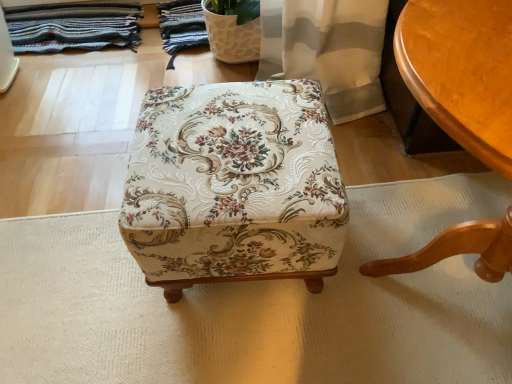
Question: Is smooth wooden table at right bigger than floral fabric ottoman at center?

Choices:
 (A) yes
 (B) no

Answer: (A)

Question: From a real-world perspective, is smooth wooden table at right on top of floral fabric ottoman at center?

Choices:
 (A) no
 (B) yes

Answer: (B)

Question: Is smooth wooden table at right thinner than floral fabric ottoman at center?

Choices:
 (A) no
 (B) yes

Answer: (A)

Question: Is smooth wooden table at right wider than floral fabric ottoman at center?

Choices:
 (A) no
 (B) yes

Answer: (B)

Question: Is smooth wooden table at right turned away from floral fabric ottoman at center?

Choices:
 (A) yes
 (B) no

Answer: (B)

Question: In terms of height, does floral fabric ottoman at center look taller or shorter compared to striped woolen blanket at upper left?

Choices:
 (A) tall
 (B) short

Answer: (A)

Question: Considering the positions of floral fabric ottoman at center and striped woolen blanket at upper left in the image, is floral fabric ottoman at center wider or thinner than striped woolen blanket at upper left?

Choices:
 (A) wide
 (B) thin

Answer: (A)

Question: From the image's perspective, is floral fabric ottoman at center positioned above or below striped woolen blanket at upper left?

Choices:
 (A) above
 (B) below

Answer: (B)

Question: Does point (249, 134) appear closer or farther from the camera than point (108, 21)?

Choices:
 (A) closer
 (B) farther

Answer: (A)

Question: Considering the positions of smooth wooden table at right and floral fabric ottoman at center in the image, is smooth wooden table at right wider or thinner than floral fabric ottoman at center?

Choices:
 (A) wide
 (B) thin

Answer: (A)

Question: Considering the positions of smooth wooden table at right and floral fabric ottoman at center in the image, is smooth wooden table at right taller or shorter than floral fabric ottoman at center?

Choices:
 (A) tall
 (B) short

Answer: (A)

Question: Is smooth wooden table at right to the left or to the right of floral fabric ottoman at center in the image?

Choices:
 (A) left
 (B) right

Answer: (B)

Question: In the image, is smooth wooden table at right positioned in front of or behind floral fabric ottoman at center?

Choices:
 (A) behind
 (B) front

Answer: (B)

Question: Considering the positions of smooth wooden table at right and striped woolen blanket at upper left in the image, is smooth wooden table at right bigger or smaller than striped woolen blanket at upper left?

Choices:
 (A) small
 (B) big

Answer: (B)

Question: Is smooth wooden table at right in front of or behind striped woolen blanket at upper left in the image?

Choices:
 (A) front
 (B) behind

Answer: (A)